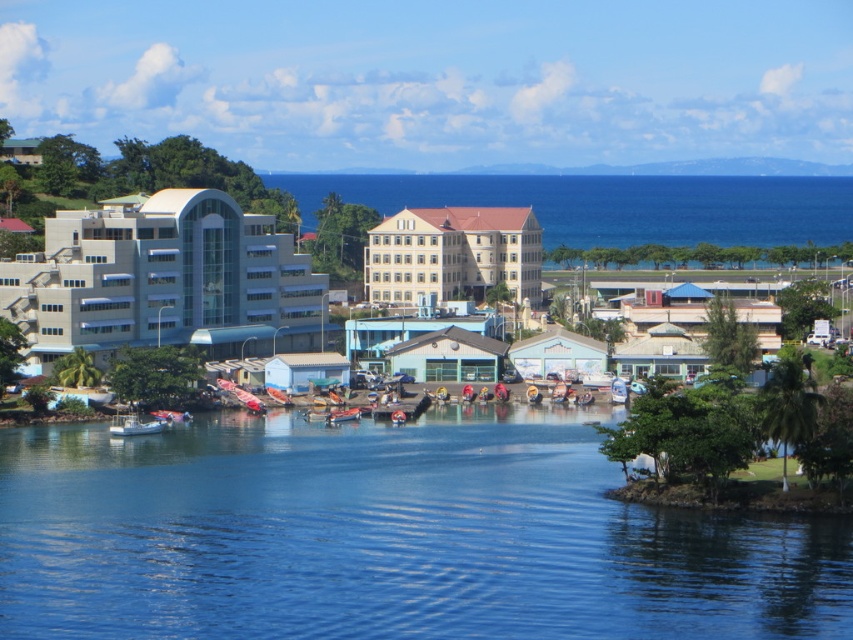
Is point (479, 228) closer to viewer compared to point (158, 426)?

No, (479, 228) is behind (158, 426).

Locate an element on the screen. beige stucco building at center is located at coordinates (453, 253).

Who is more distant from viewer, (x=442, y=220) or (x=164, y=426)?

The point (x=442, y=220) is more distant.

You are a GUI agent. You are given a task and a screenshot of the screen. Output one action in this format:
    pyautogui.click(x=<x>, y=<y>)
    Task: Click on the beige stucco building at center
    The height and width of the screenshot is (640, 853).
    Given the screenshot: What is the action you would take?
    pyautogui.click(x=453, y=253)

Does clear blue water at center have a lesser width compared to white plastic boat at lower left?

No, clear blue water at center is not thinner than white plastic boat at lower left.

Can you confirm if clear blue water at center is positioned below white plastic boat at lower left?

Indeed, clear blue water at center is positioned under white plastic boat at lower left.

Who is more distant from viewer, (550, 572) or (135, 426)?

Point (135, 426)

Locate an element on the screen. The width and height of the screenshot is (853, 640). clear blue water at center is located at coordinates (386, 536).

Does white smooth building at left appear under beige stucco building at center?

No.

Which is more to the left, white smooth building at left or beige stucco building at center?

Positioned to the left is white smooth building at left.

The width and height of the screenshot is (853, 640). Describe the element at coordinates (164, 280) in the screenshot. I see `white smooth building at left` at that location.

You are a GUI agent. You are given a task and a screenshot of the screen. Output one action in this format:
    pyautogui.click(x=<x>, y=<y>)
    Task: Click on the white smooth building at left
    The width and height of the screenshot is (853, 640).
    Given the screenshot: What is the action you would take?
    pyautogui.click(x=164, y=280)